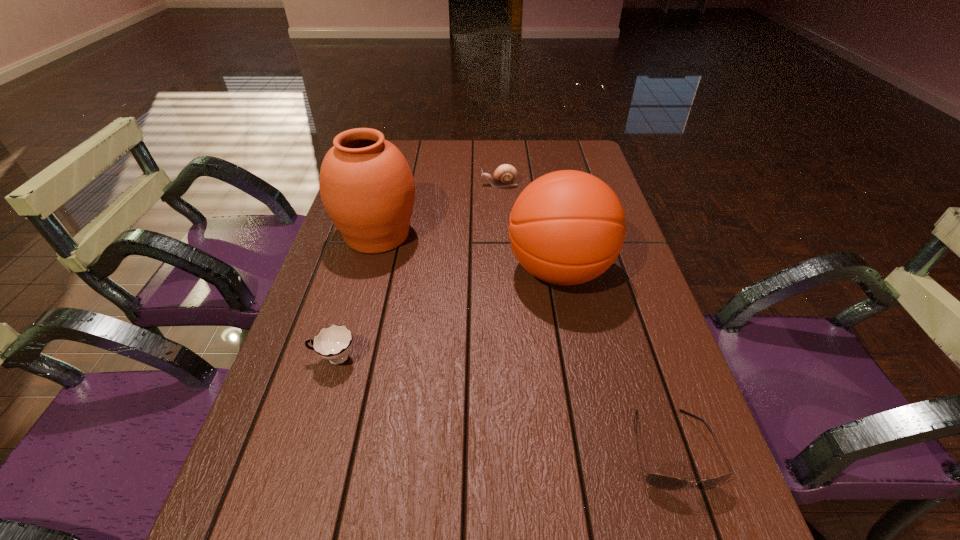
You are a GUI agent. You are given a task and a screenshot of the screen. Output one action in this format:
    pyautogui.click(x=<x>, y=<y>)
    Task: Click on the urn
    
    Given the screenshot: What is the action you would take?
    (367, 188)

I want to click on basketball, so click(x=567, y=227).

Locate an element on the screen. The height and width of the screenshot is (540, 960). escargot is located at coordinates (504, 175).

The width and height of the screenshot is (960, 540). Find the location of `cup`. cup is located at coordinates (333, 343).

At what (x,y) coordinates should I click in order to perform the action: click on the shortest object. Please return your answer as a coordinate pair (x, y). The image size is (960, 540). Looking at the image, I should click on (663, 482).

Where is `sunglasses`? sunglasses is located at coordinates (663, 482).

The image size is (960, 540). I want to click on vacant region located on the front of the urn, so click(345, 352).

The image size is (960, 540). Find the location of `free space located on the back of the basketball`. free space located on the back of the basketball is located at coordinates (550, 225).

Where is `vacant space situated 0.330m on the front-facing side of the escargot`? The width and height of the screenshot is (960, 540). vacant space situated 0.330m on the front-facing side of the escargot is located at coordinates (376, 185).

Where is `free location located on the front-facing side of the escargot`? This screenshot has width=960, height=540. free location located on the front-facing side of the escargot is located at coordinates (463, 185).